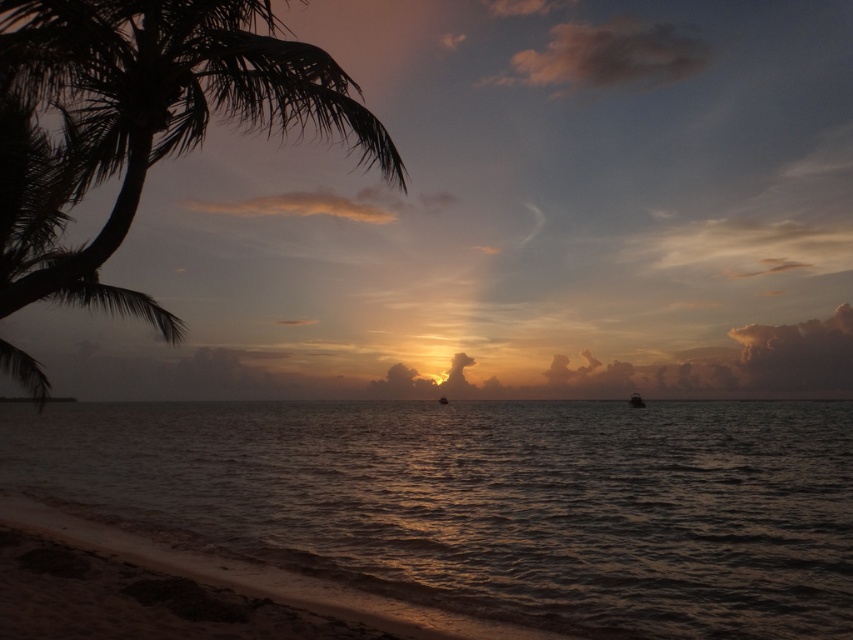
Question: Is sandy beach at lower left above metallic silver boat at center?

Choices:
 (A) yes
 (B) no

Answer: (A)

Question: Considering the relative positions of sandy beach at lower left and metallic silver boat at center in the image provided, where is sandy beach at lower left located with respect to metallic silver boat at center?

Choices:
 (A) right
 (B) left

Answer: (B)

Question: Which point is farther to the camera?

Choices:
 (A) (125, 148)
 (B) (634, 456)
 (C) (28, 563)
 (D) (636, 404)

Answer: (D)

Question: Is dull metallic water at center below metallic silver boat at center?

Choices:
 (A) yes
 (B) no

Answer: (B)

Question: Which of the following is the closest to the observer?

Choices:
 (A) (77, 141)
 (B) (634, 396)

Answer: (A)

Question: Which point is closer to the camera?

Choices:
 (A) dull metallic water at center
 (B) metallic silver boat at center
 (C) silhouette leafy palm at left
 (D) sandy beach at lower left

Answer: (C)